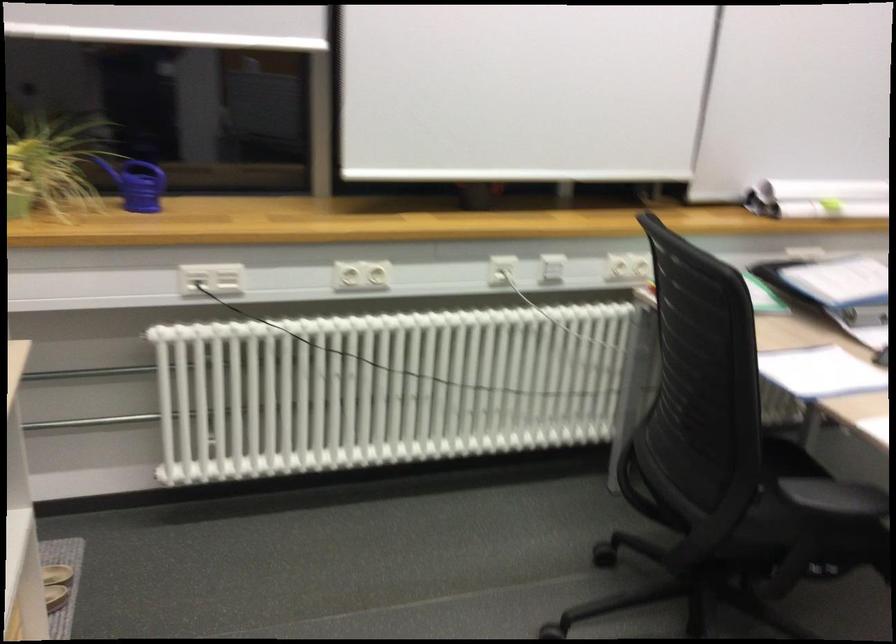
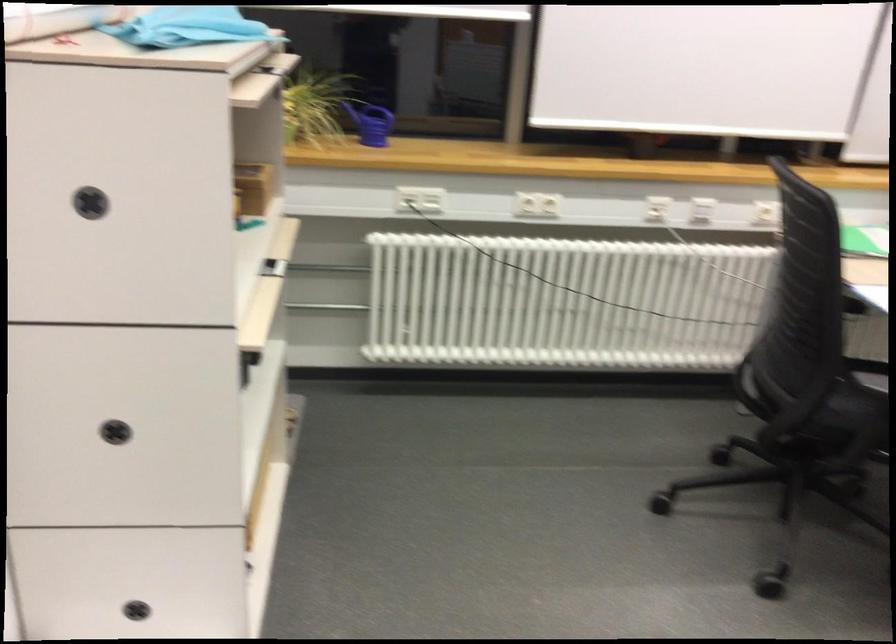
Locate, in the second image, the point that corresponds to point 140,187 in the first image.

(371, 122)